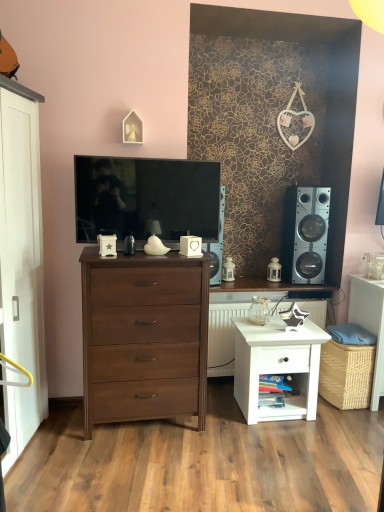
Question: Does wooden angel at upper center have a larger size compared to white glossy radiator at center?

Choices:
 (A) no
 (B) yes

Answer: (A)

Question: Is wooden angel at upper center positioned with its back to white glossy radiator at center?

Choices:
 (A) no
 (B) yes

Answer: (A)

Question: Is wooden angel at upper center smaller than white glossy radiator at center?

Choices:
 (A) no
 (B) yes

Answer: (B)

Question: From the image's perspective, is wooden angel at upper center on white glossy radiator at center?

Choices:
 (A) no
 (B) yes

Answer: (B)

Question: Is wooden angel at upper center far from white glossy radiator at center?

Choices:
 (A) no
 (B) yes

Answer: (B)

Question: Does wooden angel at upper center lie behind white glossy radiator at center?

Choices:
 (A) yes
 (B) no

Answer: (B)

Question: Considering the relative sizes of wooden angel at upper center and white glossy nightstand at lower right in the image provided, is wooden angel at upper center shorter than white glossy nightstand at lower right?

Choices:
 (A) no
 (B) yes

Answer: (B)

Question: Is wooden angel at upper center positioned behind white glossy nightstand at lower right?

Choices:
 (A) yes
 (B) no

Answer: (B)

Question: From the image's perspective, is wooden angel at upper center under white glossy nightstand at lower right?

Choices:
 (A) yes
 (B) no

Answer: (B)

Question: Are wooden angel at upper center and white glossy nightstand at lower right located far from each other?

Choices:
 (A) yes
 (B) no

Answer: (A)

Question: Does wooden angel at upper center have a greater width compared to white glossy nightstand at lower right?

Choices:
 (A) no
 (B) yes

Answer: (A)

Question: From a real-world perspective, is wooden angel at upper center located higher than white glossy nightstand at lower right?

Choices:
 (A) yes
 (B) no

Answer: (A)

Question: Considering the relative sizes of white glossy radiator at center and dark wood chest of drawers at center in the image provided, is white glossy radiator at center thinner than dark wood chest of drawers at center?

Choices:
 (A) yes
 (B) no

Answer: (B)